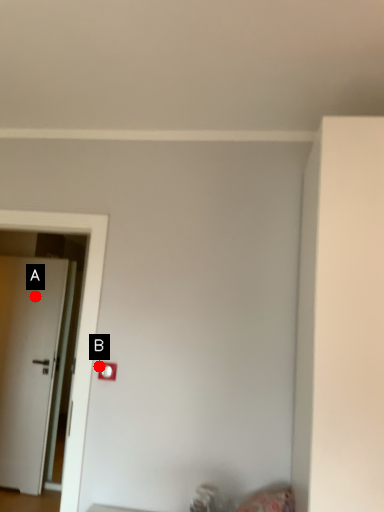
Question: Two points are circled on the image, labeled by A and B beside each circle. Which point is closer to the camera?

Choices:
 (A) A is closer
 (B) B is closer

Answer: (B)